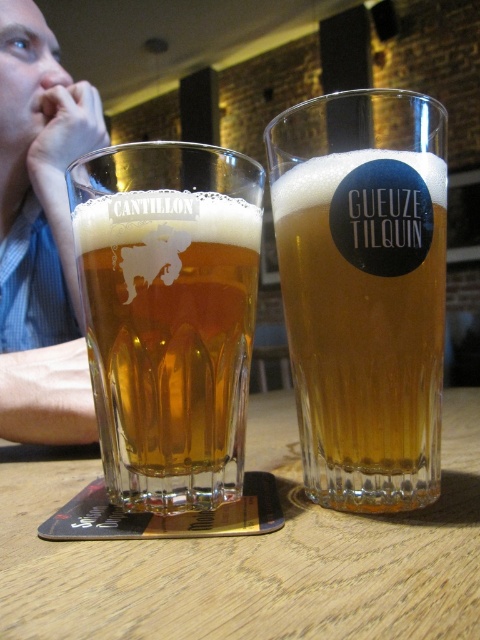
What do you see at coordinates (250, 554) in the screenshot?
I see `wooden table at center` at bounding box center [250, 554].

Where is `wooden table at center`? This screenshot has height=640, width=480. wooden table at center is located at coordinates (250, 554).

Measure the distance between translucent glass cantillon beer at left and camera.

They are 10.24 inches apart.

Does point (231, 200) come behind point (4, 168)?

No.

Where is `translucent glass cantillon beer at left`? This screenshot has height=640, width=480. translucent glass cantillon beer at left is located at coordinates (168, 316).

Who is higher up, wooden table at center or clear glass beer at center?

Positioned higher is clear glass beer at center.

Between point (115, 579) and point (355, 428), which one is positioned behind?

Positioned behind is point (355, 428).

The height and width of the screenshot is (640, 480). Find the location of `wooden table at center`. wooden table at center is located at coordinates (250, 554).